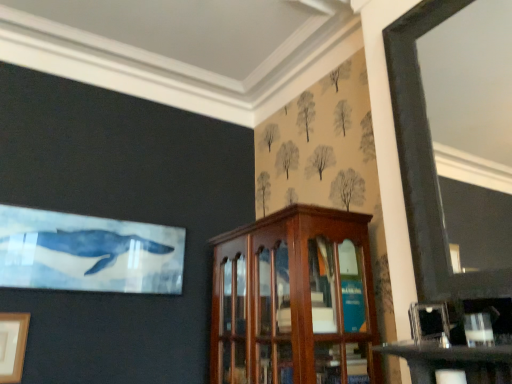
Where is `mahogany wood cabinet at center`? This screenshot has width=512, height=384. mahogany wood cabinet at center is located at coordinates (294, 300).

How much space does wooden picture frame at lower left, acting as the 1th picture frame starting from the left, occupy vertically?

The height of wooden picture frame at lower left, acting as the 1th picture frame starting from the left, is 34.12 centimeters.

Image resolution: width=512 pixels, height=384 pixels. In order to click on metallic silver picture frame at lower right, the 1th picture frame viewed from the right in this screenshot , I will do `click(429, 323)`.

Is metallic silver picture frame at lower right, which ranks as the 1th picture frame in front-to-back order, turned away from mahogany wood cabinet at center?

metallic silver picture frame at lower right, which ranks as the 1th picture frame in front-to-back order, does not have its back to mahogany wood cabinet at center.

From the image's perspective, is metallic silver picture frame at lower right, which ranks as the first picture frame in top-to-bottom order, positioned above or below mahogany wood cabinet at center?

From the image's perspective, metallic silver picture frame at lower right, which ranks as the first picture frame in top-to-bottom order, appears above mahogany wood cabinet at center.

Does point (442, 334) come behind point (297, 205)?

No, it is not.

Consider the image. From a real-world perspective, who is located higher, metallic silver picture frame at lower right, which ranks as the first picture frame in top-to-bottom order, or mahogany wood cabinet at center?

mahogany wood cabinet at center, from a real-world perspective.

From a real-world perspective, which object rests below the other?

wooden picture frame at lower left, positioned as the 1th picture frame in bottom-to-top order, from a real-world perspective.

Considering the sizes of wooden picture frame at lower left, acting as the 1th picture frame starting from the left, and metallic silver picture frame at lower right, the 2th picture frame in the back-to-front sequence, in the image, is wooden picture frame at lower left, acting as the 1th picture frame starting from the left, bigger or smaller than metallic silver picture frame at lower right, the 2th picture frame in the back-to-front sequence,?

Clearly, wooden picture frame at lower left, acting as the 1th picture frame starting from the left, is larger in size than metallic silver picture frame at lower right, the 2th picture frame in the back-to-front sequence.

Considering the sizes of wooden picture frame at lower left, which is counted as the 2th picture frame, starting from the top, and metallic silver picture frame at lower right, which ranks as the first picture frame in top-to-bottom order, in the image, is wooden picture frame at lower left, which is counted as the 2th picture frame, starting from the top, taller or shorter than metallic silver picture frame at lower right, which ranks as the first picture frame in top-to-bottom order,?

In the image, wooden picture frame at lower left, which is counted as the 2th picture frame, starting from the top, appears to be taller than metallic silver picture frame at lower right, which ranks as the first picture frame in top-to-bottom order.

Consider the image. Is wooden picture frame at lower left, acting as the 2th picture frame starting from the front, positioned far away from metallic silver picture frame at lower right, the 1th picture frame viewed from the right?

wooden picture frame at lower left, acting as the 2th picture frame starting from the front, is far away from metallic silver picture frame at lower right, the 1th picture frame viewed from the right.

Does mahogany wood cabinet at center have a lesser width compared to wooden picture frame at lower left, which is counted as the 2th picture frame, starting from the top?

In fact, mahogany wood cabinet at center might be wider than wooden picture frame at lower left, which is counted as the 2th picture frame, starting from the top.

Can you confirm if mahogany wood cabinet at center is smaller than wooden picture frame at lower left, acting as the 1th picture frame starting from the left?

Incorrect, mahogany wood cabinet at center is not smaller in size than wooden picture frame at lower left, acting as the 1th picture frame starting from the left.

Are mahogany wood cabinet at center and wooden picture frame at lower left, positioned as the 1th picture frame in bottom-to-top order, making contact?

They are not placed beside each other.

Does mahogany wood cabinet at center contain wooden picture frame at lower left, positioned as the 1th picture frame in bottom-to-top order?

Definitely not — wooden picture frame at lower left, positioned as the 1th picture frame in bottom-to-top order, is not inside mahogany wood cabinet at center.

Is metallic silver picture frame at lower right, which is the 2th picture frame in bottom-to-top order, at the back of mahogany wood cabinet at center?

No, metallic silver picture frame at lower right, which is the 2th picture frame in bottom-to-top order, is not at the back of mahogany wood cabinet at center.

Is mahogany wood cabinet at center situated inside metallic silver picture frame at lower right, the 1th picture frame viewed from the right, or outside?

The correct answer is: outside.

Where is `the 1st picture frame directly beneath the mahogany wood cabinet at center (from a real-world perspective)`? This screenshot has height=384, width=512. the 1st picture frame directly beneath the mahogany wood cabinet at center (from a real-world perspective) is located at coordinates (429, 323).

Is mahogany wood cabinet at center thinner than metallic silver picture frame at lower right, which ranks as the first picture frame in top-to-bottom order?

Incorrect, the width of mahogany wood cabinet at center is not less than that of metallic silver picture frame at lower right, which ranks as the first picture frame in top-to-bottom order.

Considering the sizes of metallic silver picture frame at lower right, which ranks as the first picture frame in top-to-bottom order, and wooden picture frame at lower left, which is counted as the 2th picture frame, starting from the top, in the image, is metallic silver picture frame at lower right, which ranks as the first picture frame in top-to-bottom order, taller or shorter than wooden picture frame at lower left, which is counted as the 2th picture frame, starting from the top,?

In the image, metallic silver picture frame at lower right, which ranks as the first picture frame in top-to-bottom order, appears to be shorter than wooden picture frame at lower left, which is counted as the 2th picture frame, starting from the top.

Is metallic silver picture frame at lower right, the 2th picture frame in the back-to-front sequence, further to the viewer compared to wooden picture frame at lower left, positioned as the 1th picture frame in bottom-to-top order?

No, metallic silver picture frame at lower right, the 2th picture frame in the back-to-front sequence, is closer to the viewer.

Which is behind, point (443, 307) or point (17, 381)?

The point (17, 381) is more distant.

Is wooden picture frame at lower left, acting as the 2th picture frame starting from the front, facing towards mahogany wood cabinet at center?

No.

Which of these two, wooden picture frame at lower left, which is counted as the 2th picture frame, starting from the top, or mahogany wood cabinet at center, stands taller?

mahogany wood cabinet at center is taller.

Can you see wooden picture frame at lower left, which is counted as the 2th picture frame, starting from the top, touching mahogany wood cabinet at center?

No, wooden picture frame at lower left, which is counted as the 2th picture frame, starting from the top, is not beside mahogany wood cabinet at center.

The height and width of the screenshot is (384, 512). Identify the location of cabinetry positioned vertically above the metallic silver picture frame at lower right, which ranks as the first picture frame in top-to-bottom order (from a real-world perspective). (294, 300).

I want to click on picture frame behind the metallic silver picture frame at lower right, which ranks as the first picture frame in top-to-bottom order, so click(x=13, y=345).

When comparing their distances from metallic silver picture frame at lower right, the 2th picture frame in the back-to-front sequence, does wooden picture frame at lower left, which is the 2th picture frame in right-to-left order, or mahogany wood cabinet at center seem further?

The object further to metallic silver picture frame at lower right, the 2th picture frame in the back-to-front sequence, is wooden picture frame at lower left, which is the 2th picture frame in right-to-left order.

When comparing their distances from mahogany wood cabinet at center, does metallic silver picture frame at lower right, the 2th picture frame in the back-to-front sequence, or wooden picture frame at lower left, positioned as the 1th picture frame in back-to-front order, seem further?

wooden picture frame at lower left, positioned as the 1th picture frame in back-to-front order, is positioned further to the anchor mahogany wood cabinet at center.

Looking at the image, which one is located closer to wooden picture frame at lower left, positioned as the 1th picture frame in back-to-front order, mahogany wood cabinet at center or metallic silver picture frame at lower right, the 2th picture frame in the back-to-front sequence?

The object closer to wooden picture frame at lower left, positioned as the 1th picture frame in back-to-front order, is mahogany wood cabinet at center.

Based on their spatial positions, is wooden picture frame at lower left, positioned as the 1th picture frame in bottom-to-top order, or metallic silver picture frame at lower right, which ranks as the first picture frame in top-to-bottom order, further from mahogany wood cabinet at center?

wooden picture frame at lower left, positioned as the 1th picture frame in bottom-to-top order, is positioned further to the anchor mahogany wood cabinet at center.

Based on their spatial positions, is mahogany wood cabinet at center or wooden picture frame at lower left, which is the 2th picture frame in right-to-left order, closer to metallic silver picture frame at lower right, which ranks as the 1th picture frame in front-to-back order?

mahogany wood cabinet at center.

Which object lies further to the anchor point wooden picture frame at lower left, which is counted as the 2th picture frame, starting from the top, metallic silver picture frame at lower right, the 1th picture frame viewed from the right, or mahogany wood cabinet at center?

metallic silver picture frame at lower right, the 1th picture frame viewed from the right, is further to wooden picture frame at lower left, which is counted as the 2th picture frame, starting from the top.

Find the location of a particular element. The image size is (512, 384). cabinetry situated between wooden picture frame at lower left, acting as the 1th picture frame starting from the left, and metallic silver picture frame at lower right, which is the second picture frame in left-to-right order, from left to right is located at coordinates (294, 300).